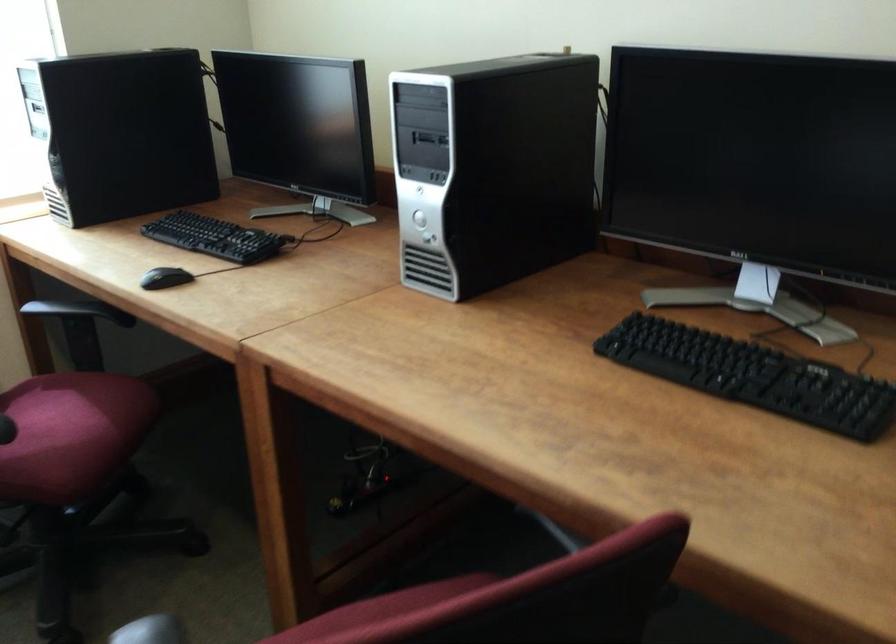
Where is `computer power button`? Image resolution: width=896 pixels, height=644 pixels. computer power button is located at coordinates (418, 219).